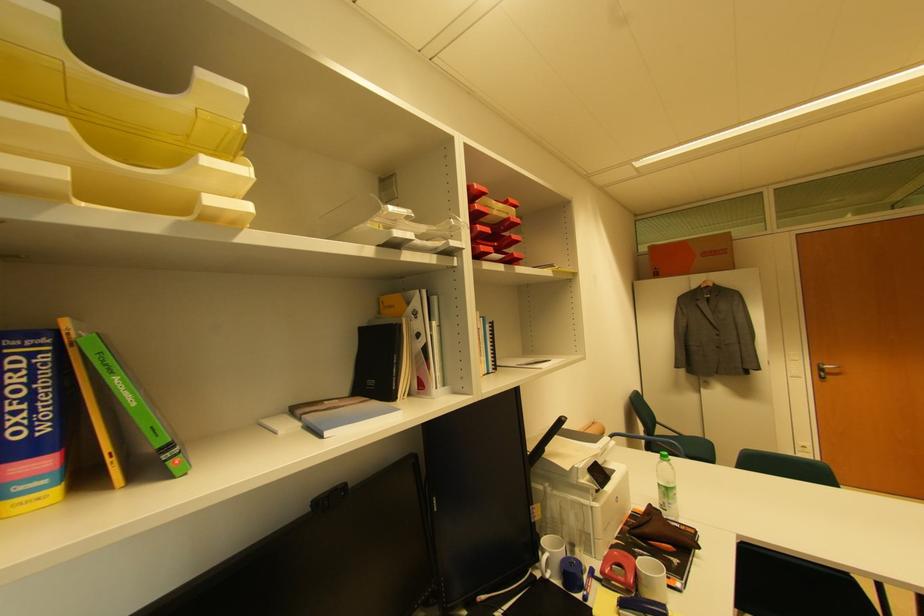
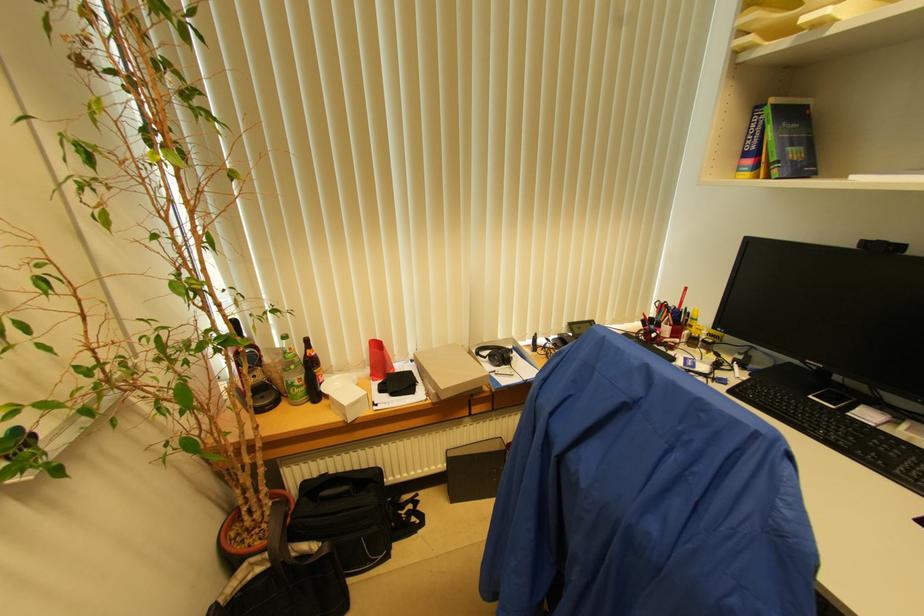
Where in the second image is the point corresponding to (x=176, y=447) from the first image?

(780, 166)